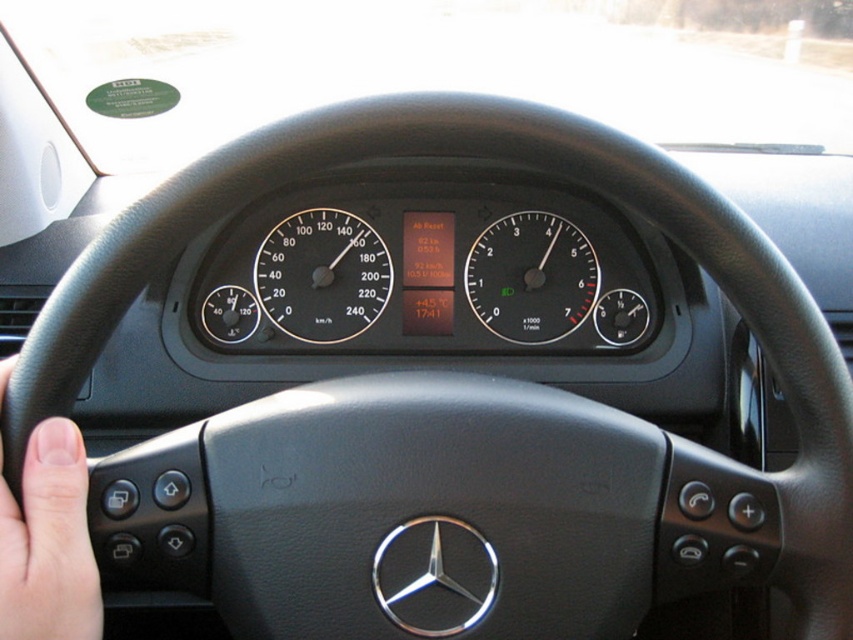
You are a car mechanic inspecting the Mercedes dashboard. There is a point marked at coordinates (322,275). What is located at this point?

The point at coordinates (322,275) marks the center of the black plastic speedometer.